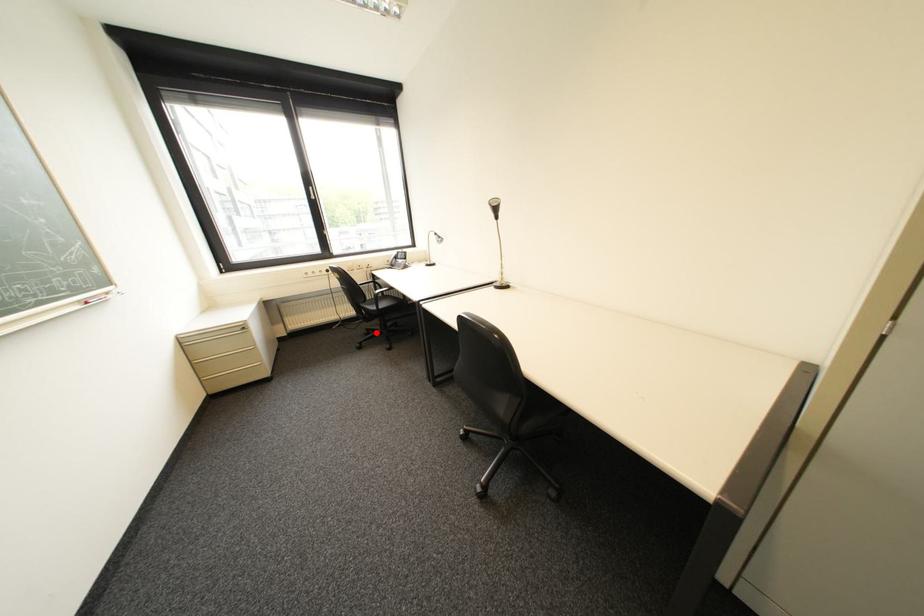
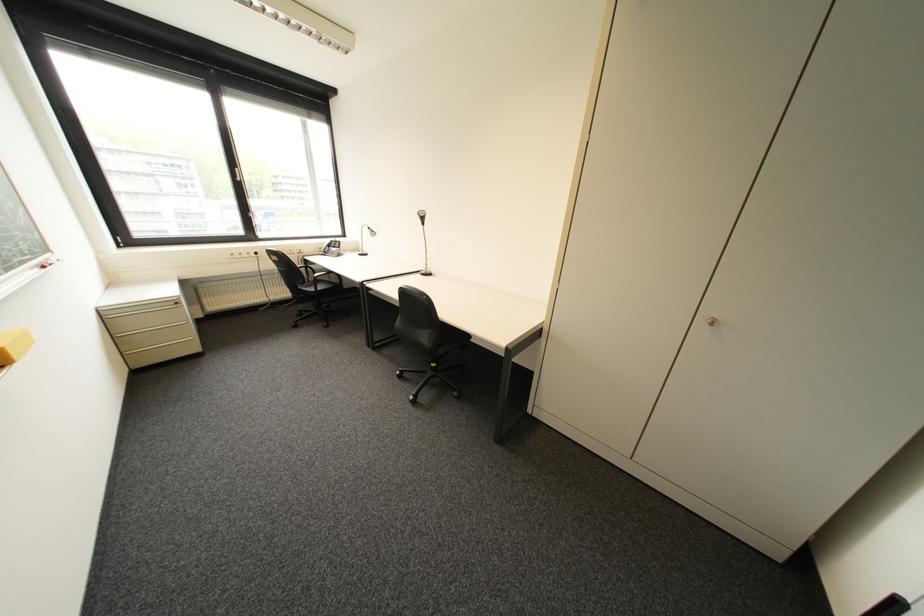
Question: I am providing you with two images of the same scene from different viewpoints. A red point is shown in image1. For the corresponding object point in image2, is it positioned nearer or farther from the camera?

Choices:
 (A) Nearer
 (B) Farther

Answer: (A)